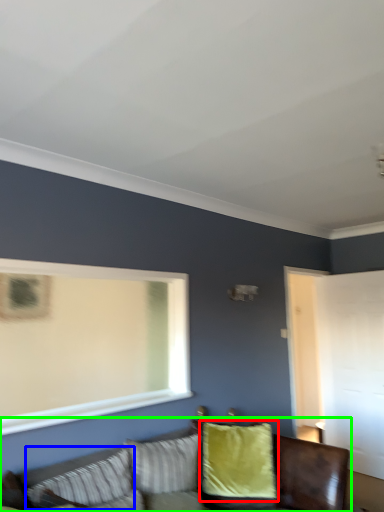
Question: Estimate the real-world distances between objects in this image. Which object is closer to pillow (highlighted by a red box), pillow (highlighted by a blue box) or studio couch (highlighted by a green box)?

Choices:
 (A) pillow
 (B) studio couch

Answer: (B)